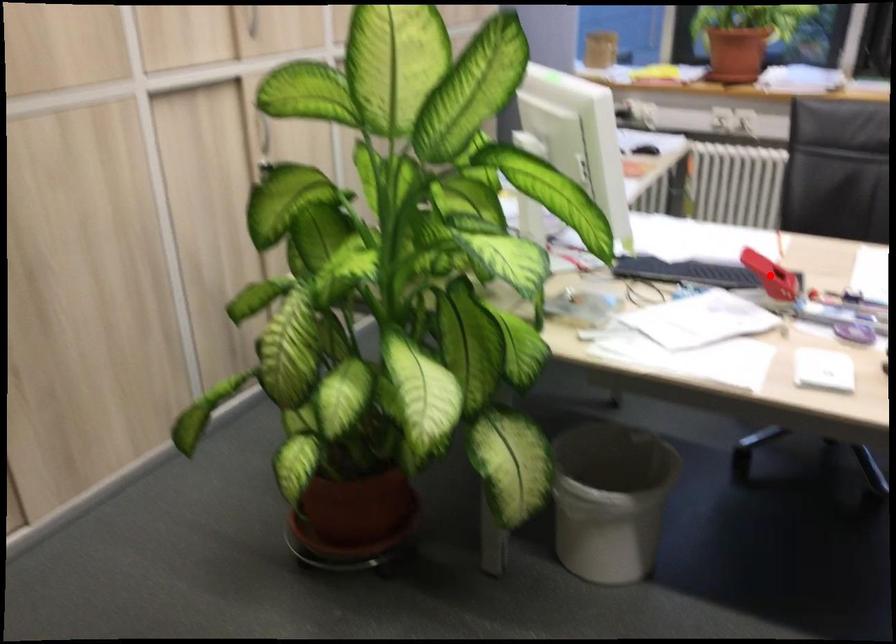
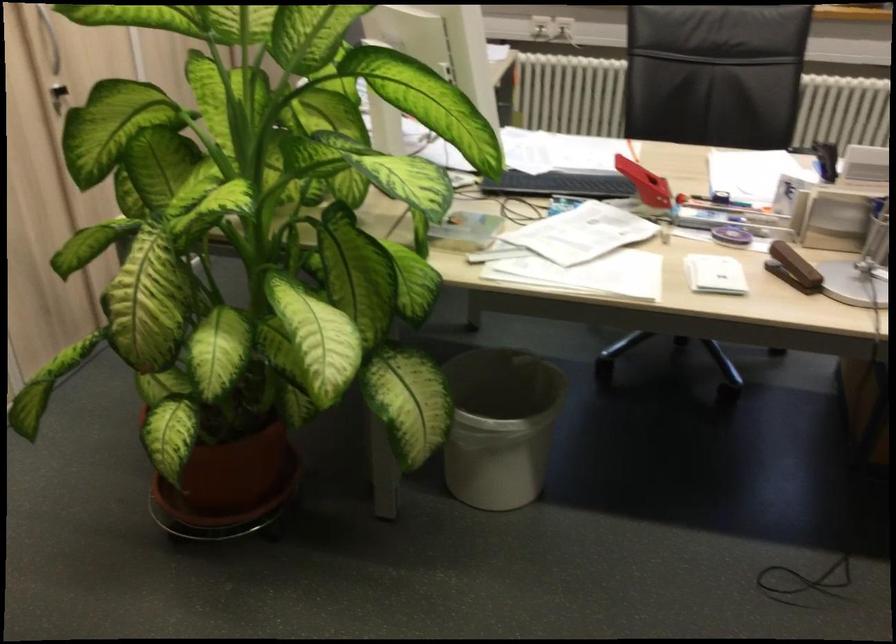
The point at the highlighted location is marked in the first image. Where is the corresponding point in the second image?

(644, 183)